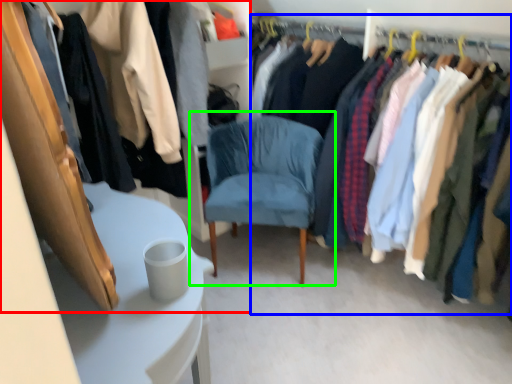
Question: Which object is positioned farthest from closet (highlighted by a red box)? Select from closet (highlighted by a blue box) and chair (highlighted by a green box).

Choices:
 (A) closet
 (B) chair

Answer: (A)